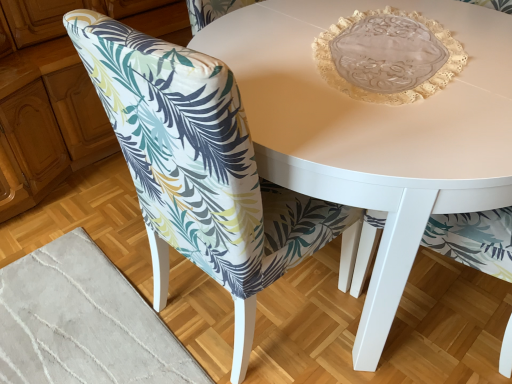
Question: From a real-world perspective, is printed fabric chair at lower left above or below white glossy table at center?

Choices:
 (A) above
 (B) below

Answer: (A)

Question: In terms of width, does printed fabric chair at lower left look wider or thinner when compared to white glossy table at center?

Choices:
 (A) wide
 (B) thin

Answer: (B)

Question: Considering their positions, is printed fabric chair at lower left located in front of or behind white glossy table at center?

Choices:
 (A) front
 (B) behind

Answer: (A)

Question: Does point (508, 72) appear closer or farther from the camera than point (125, 135)?

Choices:
 (A) closer
 (B) farther

Answer: (B)

Question: Is white glossy table at center inside or outside of printed fabric chair at lower left?

Choices:
 (A) inside
 (B) outside

Answer: (B)

Question: Is white glossy table at center bigger or smaller than printed fabric chair at lower left?

Choices:
 (A) big
 (B) small

Answer: (A)

Question: Looking at their shapes, would you say white glossy table at center is wider or thinner than printed fabric chair at lower left?

Choices:
 (A) wide
 (B) thin

Answer: (A)